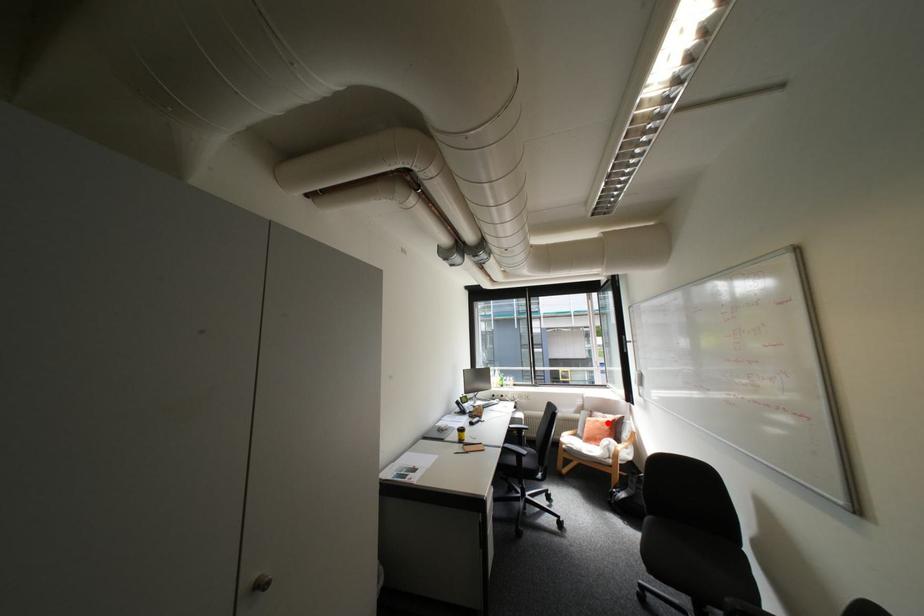
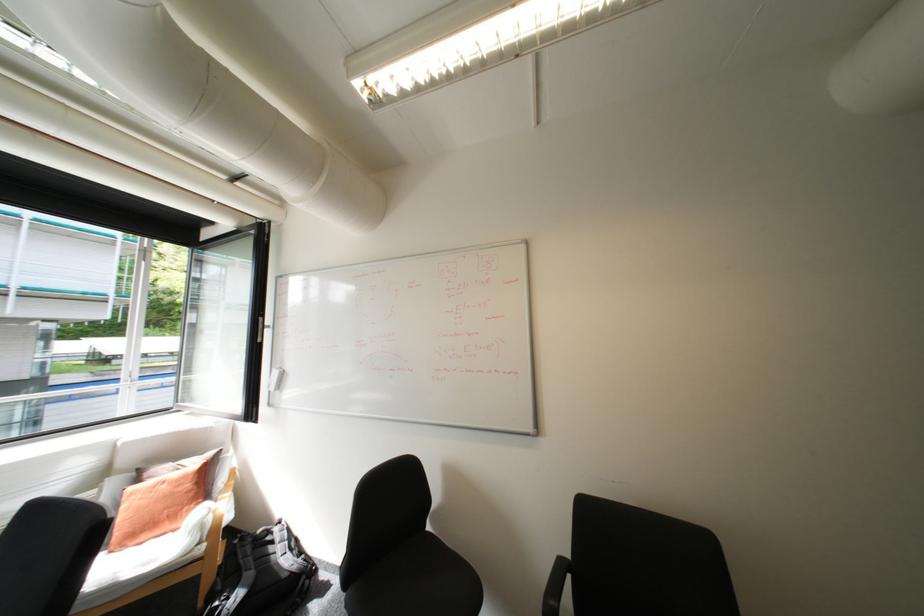
Locate, in the second image, the point that corresponds to the highlighted location in the first image.

(175, 485)